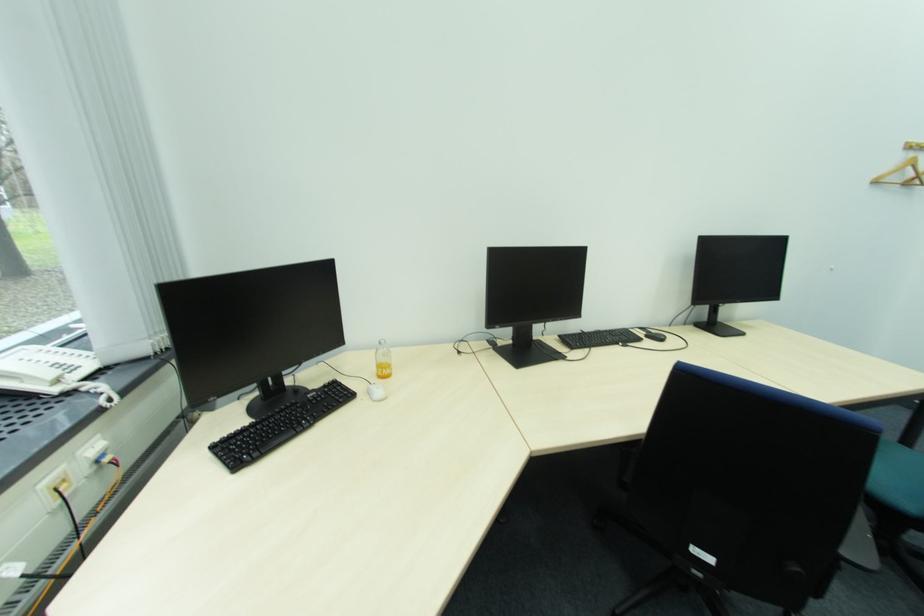
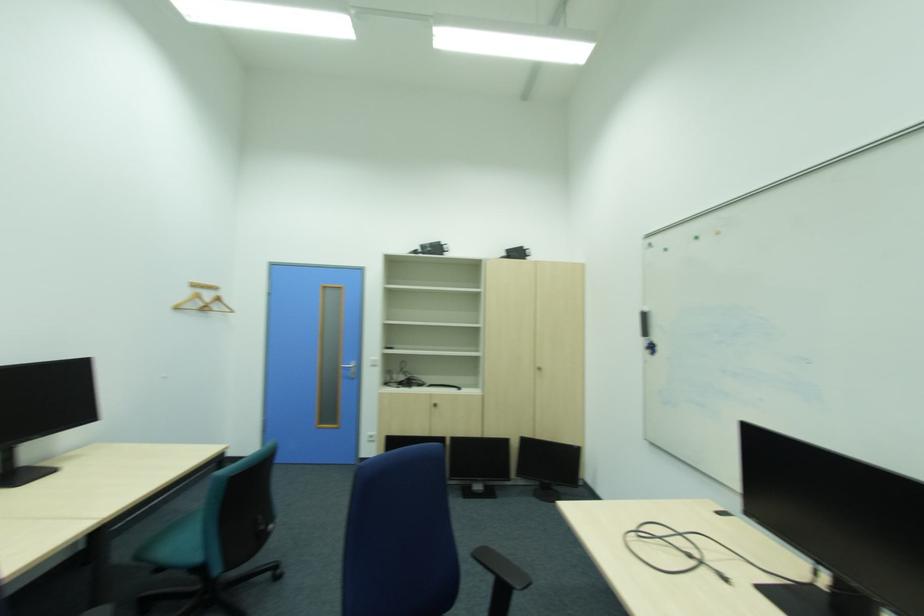
Question: The first image is from the beginning of the video and the second image is from the end. How did the camera likely rotate when shooting the video?

Choices:
 (A) Left
 (B) Right
 (C) Up
 (D) Down

Answer: (B)